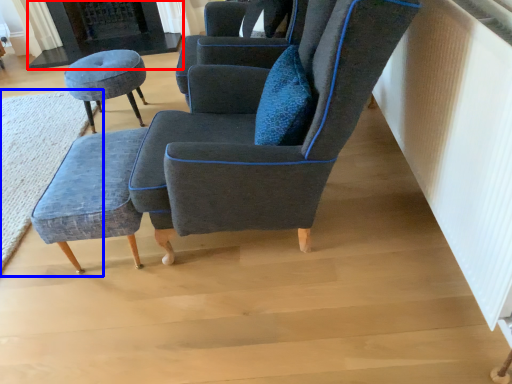
Question: Among these objects, which one is nearest to the camera, fireplace (highlighted by a red box) or mat (highlighted by a blue box)?

Choices:
 (A) fireplace
 (B) mat

Answer: (B)